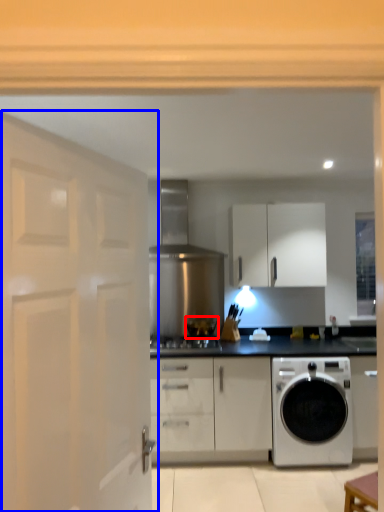
Question: Which of the following is the closest to the observer, appliance (highlighted by a red box) or door (highlighted by a blue box)?

Choices:
 (A) appliance
 (B) door

Answer: (B)